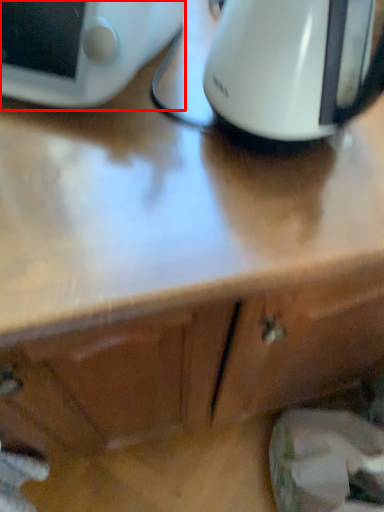
Question: Where is home appliance (annotated by the red box) located in relation to kitchen appliance in the image?

Choices:
 (A) left
 (B) right

Answer: (A)